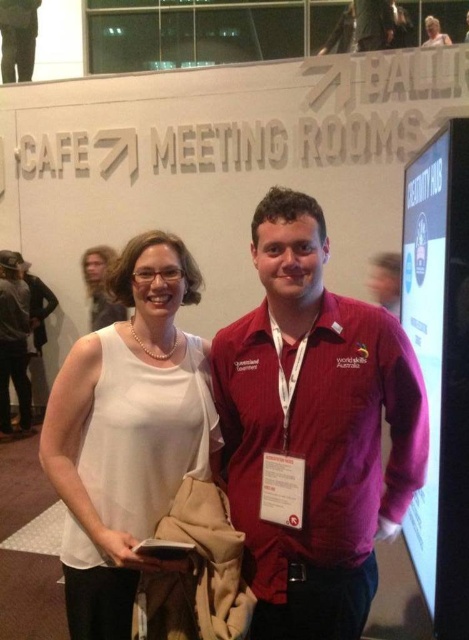
Can you confirm if matte red jacket at center is positioned above white matte tank top at center?

Indeed, matte red jacket at center is positioned over white matte tank top at center.

Is matte red jacket at center wider than white matte tank top at center?

Yes, matte red jacket at center is wider than white matte tank top at center.

What do you see at coordinates (315, 428) in the screenshot?
I see `matte red jacket at center` at bounding box center [315, 428].

Locate an element on the screen. The width and height of the screenshot is (469, 640). matte red jacket at center is located at coordinates (315, 428).

Between matte red jacket at center and matte black hair at upper left, which one appears on the right side from the viewer's perspective?

From the viewer's perspective, matte red jacket at center appears more on the right side.

Between matte red jacket at center and matte black hair at upper left, which one is positioned lower?

matte red jacket at center is lower down.

Which is in front, point (312, 227) or point (121, 317)?

Point (312, 227)

At what (x,y) coordinates should I click in order to perform the action: click on matte red jacket at center. Please return your answer as a coordinate pair (x, y). Image resolution: width=469 pixels, height=640 pixels. Looking at the image, I should click on (315, 428).

In the scene shown: Who is lower down, white matte tank top at center or matte black hair at upper left?

Positioned lower is white matte tank top at center.

Is white matte tank top at center shorter than matte black hair at upper left?

No.

Does point (104, 611) come in front of point (113, 252)?

Yes, it is.

Locate an element on the screen. This screenshot has height=640, width=469. white matte tank top at center is located at coordinates (123, 432).